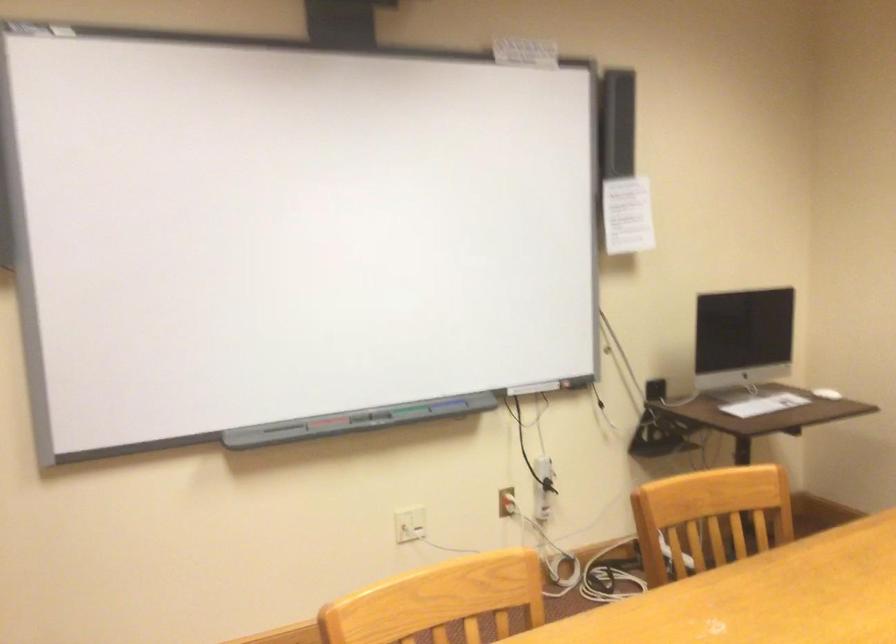
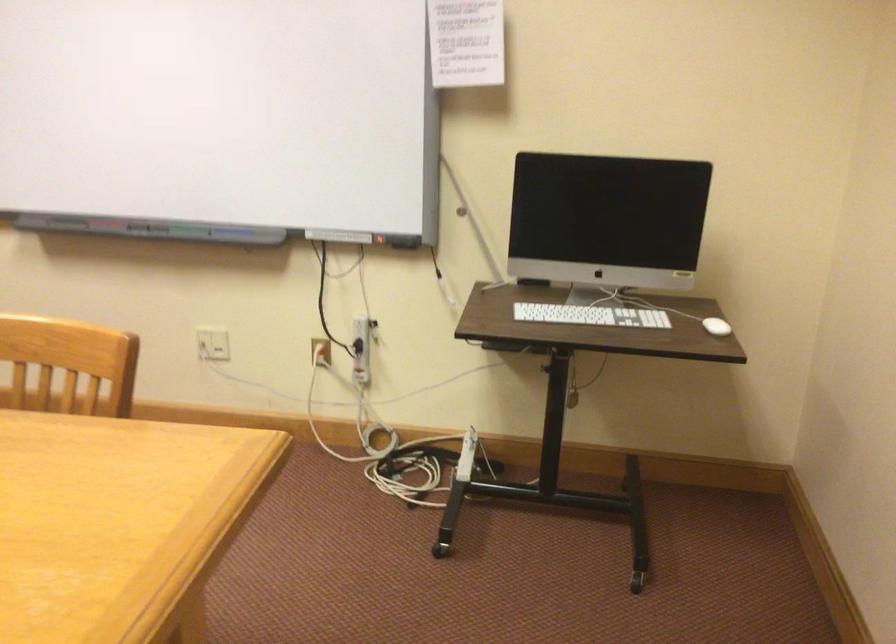
Locate, in the second image, the point that corresponds to [426,410] in the first image.

(187, 230)